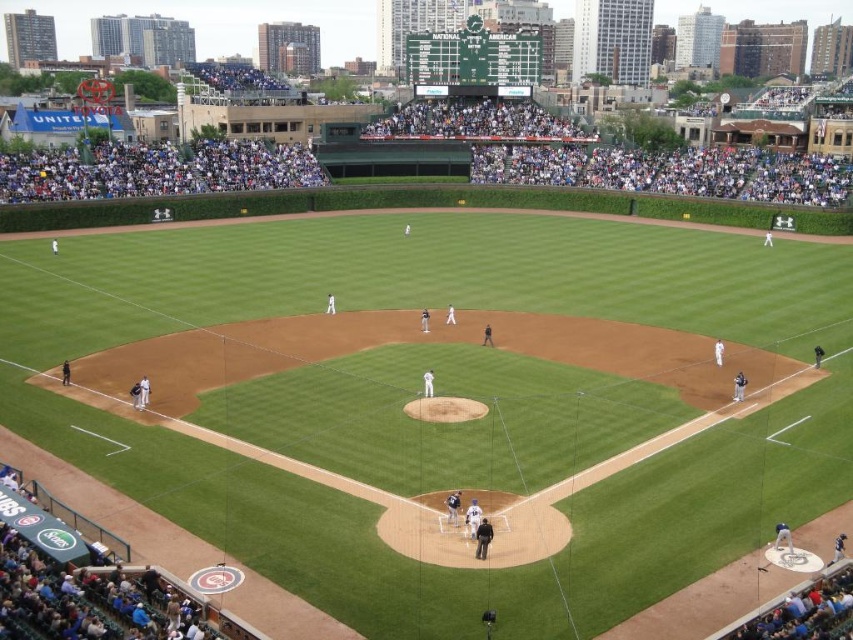
Can you confirm if white fabric crowd at upper left is positioned below white uniform at center?

Incorrect, white fabric crowd at upper left is not positioned below white uniform at center.

Is white fabric crowd at upper left smaller than white uniform at center?

Incorrect, white fabric crowd at upper left is not smaller in size than white uniform at center.

Where is `white fabric crowd at upper left`? This screenshot has width=853, height=640. white fabric crowd at upper left is located at coordinates (154, 170).

Can you confirm if white fabric crowd at upper left is positioned below dark gray uniform at lower right?

Actually, white fabric crowd at upper left is above dark gray uniform at lower right.

Based on the photo, which is below, white fabric crowd at upper left or dark gray uniform at lower right?

dark gray uniform at lower right is below.

Image resolution: width=853 pixels, height=640 pixels. Identify the location of white fabric crowd at upper left. (154, 170).

Is dark gray uniform at lower right positioned behind white uniform at center?

Yes, it is.

Identify the location of dark gray uniform at lower right. (738, 387).

You are a GUI agent. You are given a task and a screenshot of the screen. Output one action in this format:
    pyautogui.click(x=<x>, y=<y>)
    Task: Click on the dark gray uniform at lower right
    
    Given the screenshot: What is the action you would take?
    pyautogui.click(x=738, y=387)